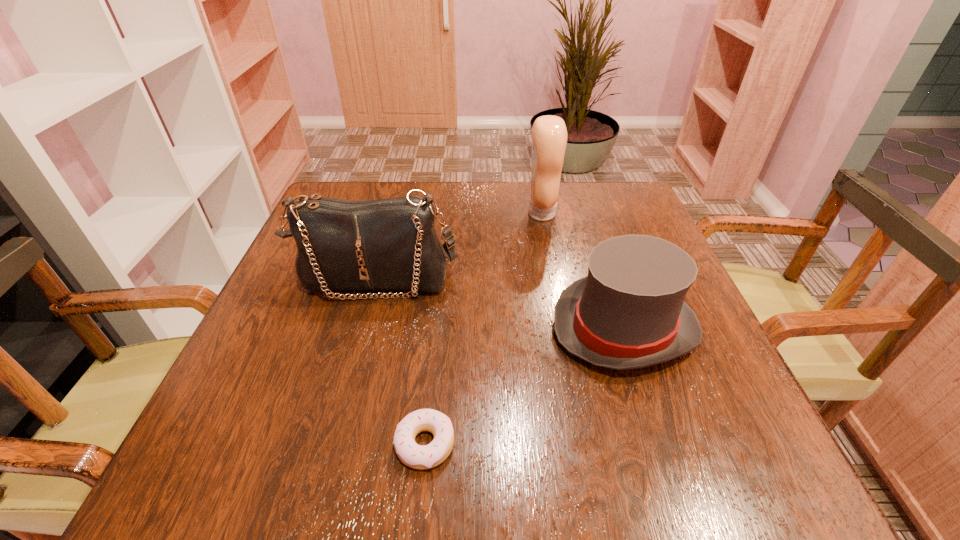
Where is `the second closest object relative to the handbag`? This screenshot has width=960, height=540. the second closest object relative to the handbag is located at coordinates (549, 133).

You are a GUI agent. You are given a task and a screenshot of the screen. Output one action in this format:
    pyautogui.click(x=<x>, y=<y>)
    Task: Click on the object identified as the third closest to the handbag
    This screenshot has width=960, height=540.
    Given the screenshot: What is the action you would take?
    pyautogui.click(x=421, y=457)

Image resolution: width=960 pixels, height=540 pixels. Find the location of `vacant region that satisfies the following two spatial constraints: 1. on the label of the farthest object; 2. at the front of the handbag with chain and zipper`. vacant region that satisfies the following two spatial constraints: 1. on the label of the farthest object; 2. at the front of the handbag with chain and zipper is located at coordinates [554, 280].

At what (x,y) coordinates should I click in order to perform the action: click on vacant area in the image that satisfies the following two spatial constraints: 1. on the label of the farthest object; 2. at the front of the handbag with chain and zipper. Please return your answer as a coordinate pair (x, y). The height and width of the screenshot is (540, 960). Looking at the image, I should click on (554, 280).

Where is `vacant area in the image that satisfies the following two spatial constraints: 1. on the label of the farthest object; 2. on the front side of the shortest object`? The image size is (960, 540). vacant area in the image that satisfies the following two spatial constraints: 1. on the label of the farthest object; 2. on the front side of the shortest object is located at coordinates (585, 444).

This screenshot has width=960, height=540. What are the coordinates of `vacant space that satisfies the following two spatial constraints: 1. at the front of the nearest object with chain and zipper; 2. on the right side of the handbag` in the screenshot? It's located at (332, 444).

Where is `free space that satisfies the following two spatial constraints: 1. at the front of the dress hat with chain and zipper; 2. on the right side of the handbag`? free space that satisfies the following two spatial constraints: 1. at the front of the dress hat with chain and zipper; 2. on the right side of the handbag is located at coordinates (364, 328).

Find the location of `free spot that satisfies the following two spatial constraints: 1. at the front of the handbag with chain and zipper; 2. on the right side of the shortest object`. free spot that satisfies the following two spatial constraints: 1. at the front of the handbag with chain and zipper; 2. on the right side of the shortest object is located at coordinates (332, 444).

Identify the location of free location that satisfies the following two spatial constraints: 1. at the front of the dress hat with chain and zipper; 2. on the right side of the handbag. (364, 328).

Identify the location of free space that satisfies the following two spatial constraints: 1. at the front of the handbag with chain and zipper; 2. on the left side of the shortest object. The height and width of the screenshot is (540, 960). (332, 444).